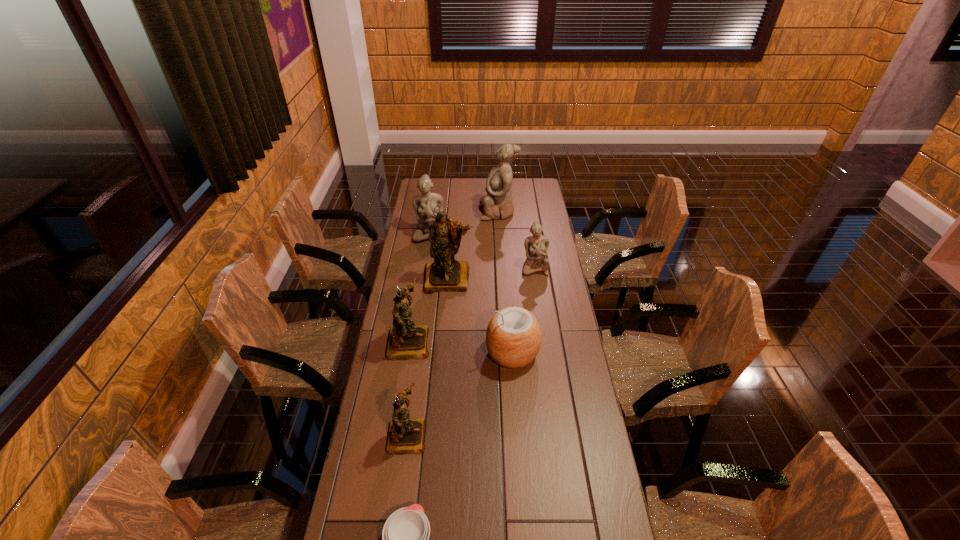
What are the coordinates of `the closest figurine to the second nearest object` in the screenshot? It's located at pos(406,341).

Locate an element on the screen. The width and height of the screenshot is (960, 540). figurine that is the nearest to the second biggest white figurine is located at coordinates (445, 274).

Find the location of a particular element. white figurine that is the closest to the second farthest figurine is located at coordinates (498, 203).

Identify which white figurine is the second nearest to the second nearest figurine. Please provide its 2D coordinates. Your answer should be formatted as a tuple, i.e. [(x, y)], where the tuple contains the x and y coordinates of a point satisfying the conditions above.

[(424, 203)]

Locate which gold figurine is the third closest to the smallest white figurine. Please provide its 2D coordinates. Your answer should be formatted as a tuple, i.e. [(x, y)], where the tuple contains the x and y coordinates of a point satisfying the conditions above.

[(405, 435)]

Identify which gold figurine is the closest to the farthest gold figurine. Please provide its 2D coordinates. Your answer should be formatted as a tuple, i.e. [(x, y)], where the tuple contains the x and y coordinates of a point satisfying the conditions above.

[(406, 341)]

Identify the location of free space in the image that satisfies the following two spatial constraints: 1. on the front-facing side of the second farthest figurine; 2. on the left side of the coconut. (413, 353).

At what (x,y) coordinates should I click in order to perform the action: click on free point that satisfies the following two spatial constraints: 1. on the back side of the coconut; 2. on the front-facing side of the second farthest gold figurine. Please return your answer as a coordinate pair (x, y). The image size is (960, 540). Looking at the image, I should click on (512, 342).

The height and width of the screenshot is (540, 960). In order to click on blank space that satisfies the following two spatial constraints: 1. on the front-facing side of the smallest white figurine; 2. on the front-facing side of the second nearest figurine in this screenshot , I will do `click(545, 342)`.

Image resolution: width=960 pixels, height=540 pixels. Find the location of `vacant space that satisfies the following two spatial constraints: 1. on the front-facing side of the smallest white figurine; 2. on the front-facing side of the second farthest gold figurine`. vacant space that satisfies the following two spatial constraints: 1. on the front-facing side of the smallest white figurine; 2. on the front-facing side of the second farthest gold figurine is located at coordinates (545, 342).